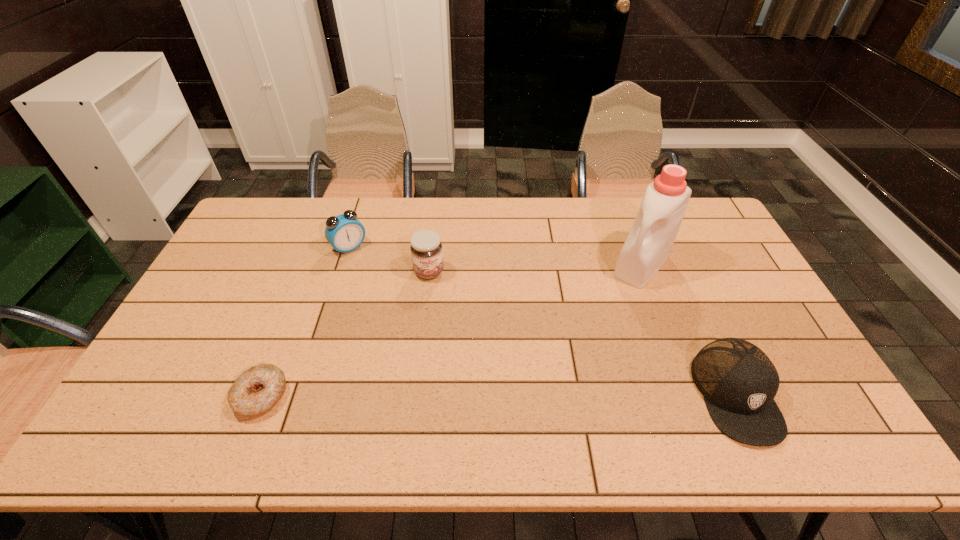
This screenshot has width=960, height=540. Find the location of `vacant region between the jam and the tallest object`. vacant region between the jam and the tallest object is located at coordinates (535, 268).

Find the location of `free spot between the cap and the tallest object`. free spot between the cap and the tallest object is located at coordinates (688, 330).

Locate an element on the screen. vacant space in between the alarm clock and the third object from left to right is located at coordinates (389, 260).

Identify the location of free space between the jam and the alarm clock. This screenshot has height=540, width=960. (389, 260).

What are the coordinates of `free spot between the alarm clock and the detergent` in the screenshot? It's located at (495, 256).

Locate an element on the screen. unoccupied position between the cap and the detergent is located at coordinates (688, 330).

Locate an element on the screen. empty space between the shortest object and the jam is located at coordinates (346, 334).

Where is `the fourth closest object to the jam`? This screenshot has width=960, height=540. the fourth closest object to the jam is located at coordinates (738, 381).

Where is `the fourth closest object relative to the tallest object`? This screenshot has height=540, width=960. the fourth closest object relative to the tallest object is located at coordinates (258, 389).

Find the location of a particular element. The height and width of the screenshot is (540, 960). free point that satisfies the following two spatial constraints: 1. on the front side of the detergent; 2. on the left side of the alarm clock is located at coordinates (344, 265).